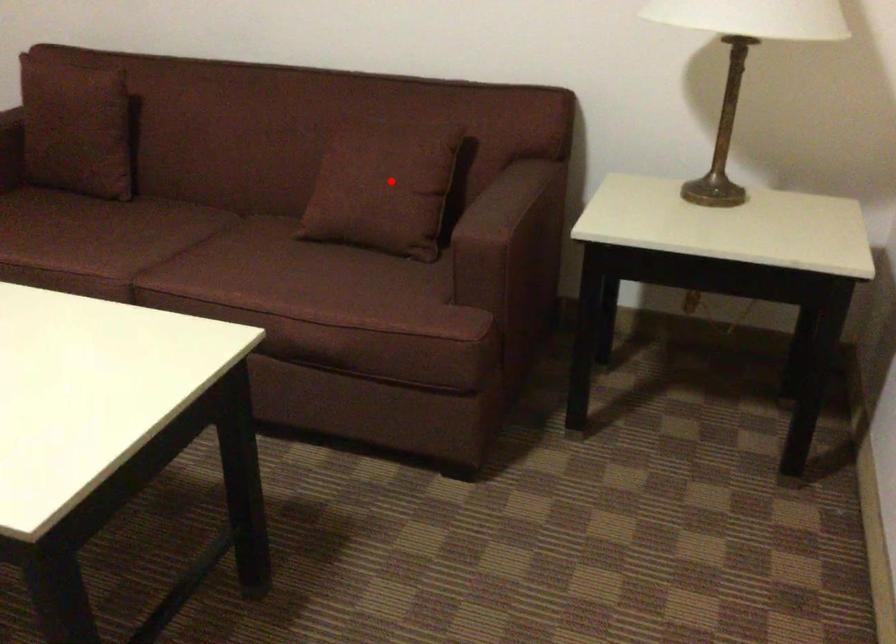
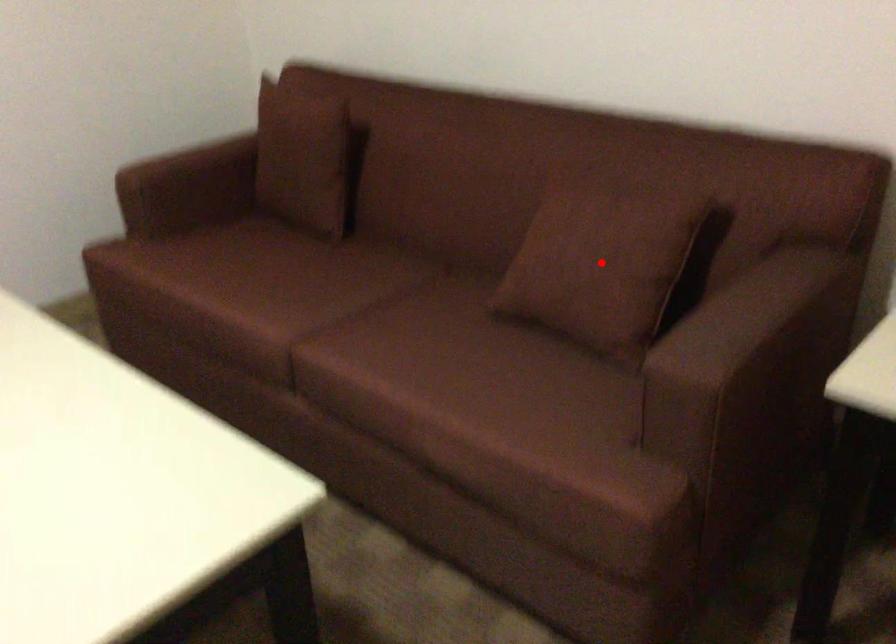
I am providing you with two images of the same scene from different viewpoints. A red point is marked on the first image and another point is marked on the second image. Is the red point in image1 aligned with the point shown in image2?

Yes